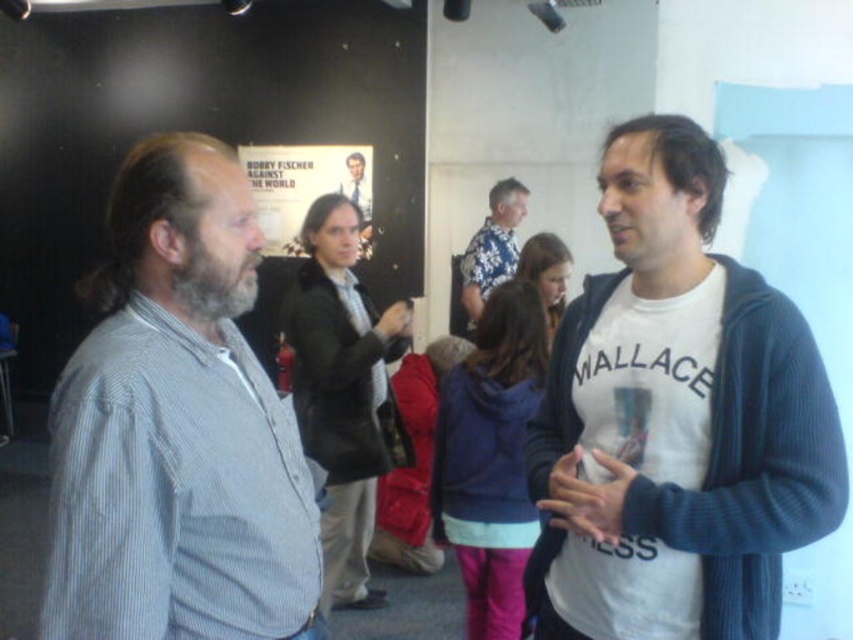
Question: Does floral fabric shirt at center appear on the left side of smooth black suit at center?

Choices:
 (A) no
 (B) yes

Answer: (A)

Question: Among these objects, which one is farthest from the camera?

Choices:
 (A) smooth black suit at center
 (B) floral fabric shirt at center

Answer: (A)

Question: Is white cotton t-shirt at center to the right of floral fabric shirt at center from the viewer's perspective?

Choices:
 (A) yes
 (B) no

Answer: (A)

Question: Is white cotton t-shirt at center in front of floral fabric shirt at center?

Choices:
 (A) no
 (B) yes

Answer: (B)

Question: Which is farther from the striped cotton shirt at left?

Choices:
 (A) floral fabric shirt at center
 (B) smooth black suit at center
 (C) white cotton t-shirt at center

Answer: (B)

Question: Which of these objects is positioned closest to the floral fabric shirt at center?

Choices:
 (A) striped cotton shirt at left
 (B) white cotton t-shirt at center

Answer: (B)